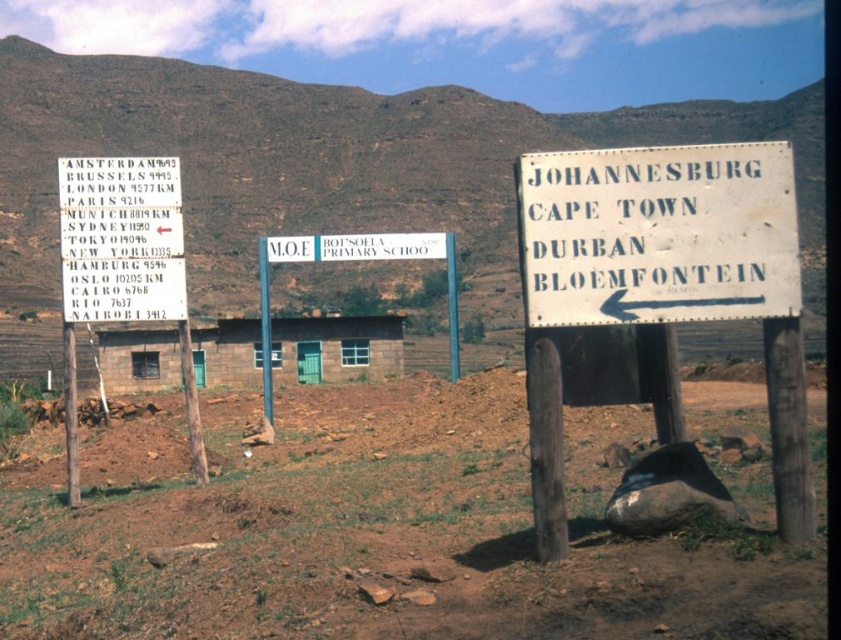
Can you confirm if white painted wood sign at right is positioned above white paper sign at upper left?

Actually, white painted wood sign at right is below white paper sign at upper left.

Locate an element on the screen. This screenshot has width=841, height=640. white painted wood sign at right is located at coordinates point(659,234).

Which is behind, point (746, 276) or point (83, 321)?

The point (83, 321) is behind.

You are a GUI agent. You are given a task and a screenshot of the screen. Output one action in this format:
    pyautogui.click(x=<x>, y=<y>)
    Task: Click on the white painted wood sign at right
    
    Given the screenshot: What is the action you would take?
    pyautogui.click(x=659, y=234)

Is point (713, 579) positioned behind point (267, 308)?

That is False.

Is brown soil at center below white wooden sign at center?

Yes, brown soil at center is below white wooden sign at center.

Find the location of a particular element. Image resolution: width=841 pixels, height=640 pixels. brown soil at center is located at coordinates (368, 531).

In order to click on brown soil at center in this screenshot , I will do `click(368, 531)`.

Does white paper sign at upper left appear over white wooden sign at center?

Actually, white paper sign at upper left is below white wooden sign at center.

Between point (98, 182) and point (448, 308), which one is positioned in front?

Point (98, 182) is more forward.

Where is `white paper sign at upper left`? white paper sign at upper left is located at coordinates (120, 240).